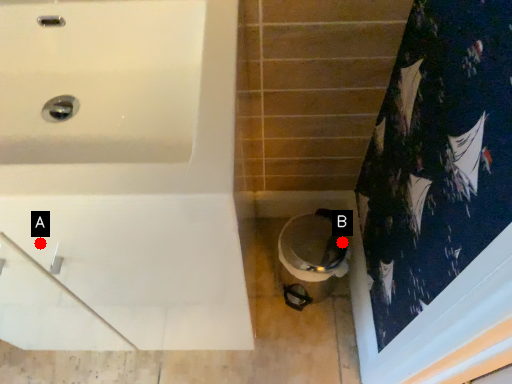
Question: Two points are circled on the image, labeled by A and B beside each circle. Which point is closer to the camera?

Choices:
 (A) A is closer
 (B) B is closer

Answer: (A)